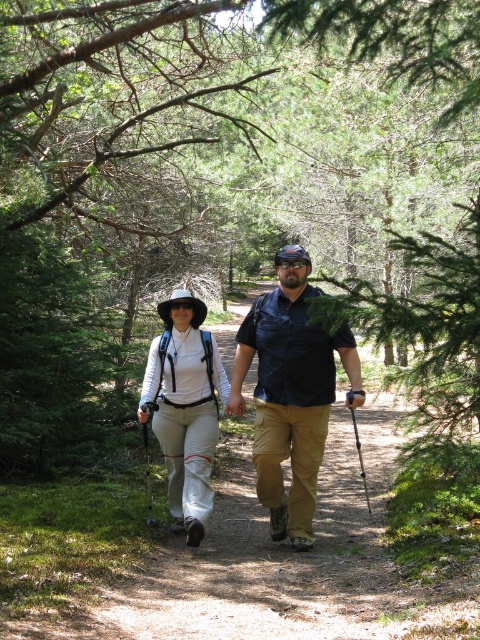
Can you confirm if matte blue shirt at center is positioned to the left of white fabric hat at center?

In fact, matte blue shirt at center is to the right of white fabric hat at center.

What do you see at coordinates (290, 392) in the screenshot? Image resolution: width=480 pixels, height=640 pixels. I see `matte blue shirt at center` at bounding box center [290, 392].

Does point (286, 260) come behind point (191, 451)?

No, (286, 260) is in front of (191, 451).

This screenshot has height=640, width=480. In order to click on matte blue shirt at center in this screenshot , I will do `click(290, 392)`.